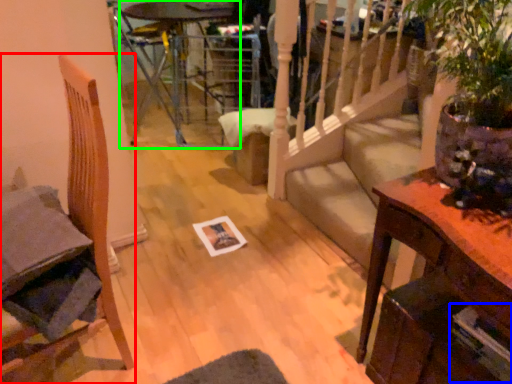
Question: Which object is the closest to the chair (highlighted by a red box)? Choose among these: magazine (highlighted by a blue box) or glass table (highlighted by a green box).

Choices:
 (A) magazine
 (B) glass table

Answer: (A)